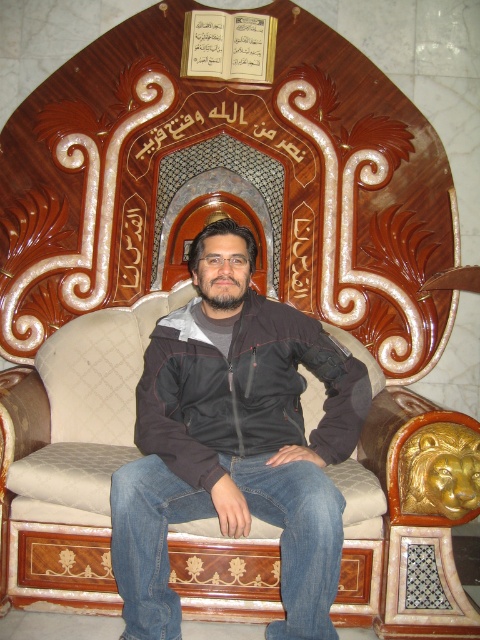
You are a fashion stylist trying to decide which jacket to feature in a photo shoot. You have two jackets in front of you, the black matte jacket at center and the black softshell jacket at center. Based on their positions in the image, which jacket is more visible to the viewer?

The black matte jacket at center is more visible to the viewer because it is positioned in front of the black softshell jacket at center.

You are a tailor who needs to hang two jackets in a narrow closet. The black matte jacket at center and the black softshell jacket at center are currently placed side by side. Can you fit both jackets into the closet if the closet is 8 centimeters wide?

The black matte jacket at center and the black softshell jacket at center are 7.83 centimeters apart from each other, so yes, both jackets can fit into the 8 centimeter wide closet since the total width required is less than the available space.

You are a guest in this room and want to place a new decorative item between the black softshell jacket at center and the wooden carved book at upper center. Which object should the new item be placed closer to?

The new decorative item should be placed closer to the wooden carved book at upper center since the black softshell jacket at center is positioned under it, indicating the book is above the jacket.